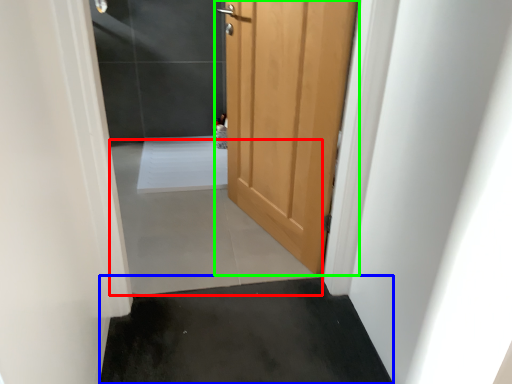
Question: Considering the real-world distances, which object is closest to concrete (highlighted by a red box)? concrete (highlighted by a blue box) or door (highlighted by a green box).

Choices:
 (A) concrete
 (B) door

Answer: (A)